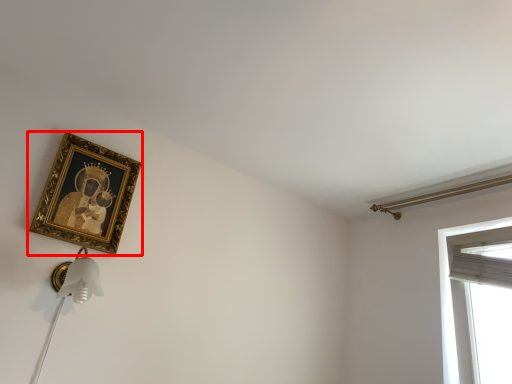
Question: From the image, what is the correct spatial relationship of picture frame (annotated by the red box) in relation to curtain?

Choices:
 (A) left
 (B) right

Answer: (A)